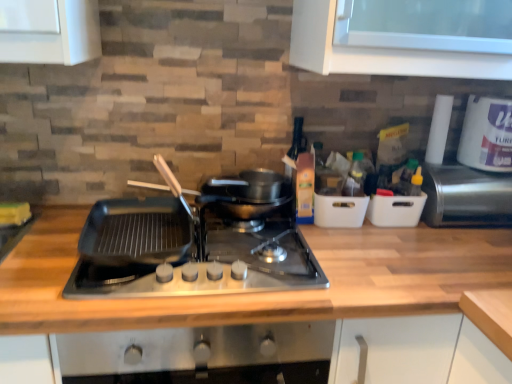
Where is `vacant area located to the right-hand side of white plastic container at right, marked as the 2th appliance in a right-to-left arrangement`? Image resolution: width=512 pixels, height=384 pixels. vacant area located to the right-hand side of white plastic container at right, marked as the 2th appliance in a right-to-left arrangement is located at coordinates (463, 233).